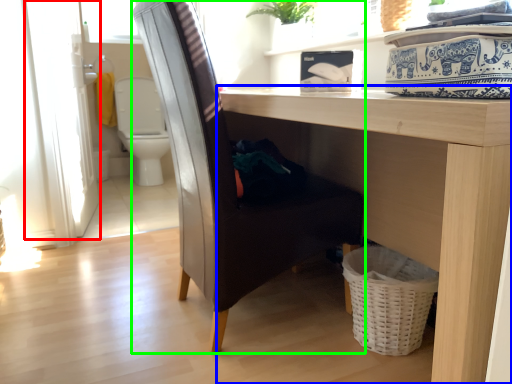
Question: Considering the real-world distances, which object is closest to screen door (highlighted by a red box)? table (highlighted by a blue box) or chair (highlighted by a green box).

Choices:
 (A) table
 (B) chair

Answer: (B)